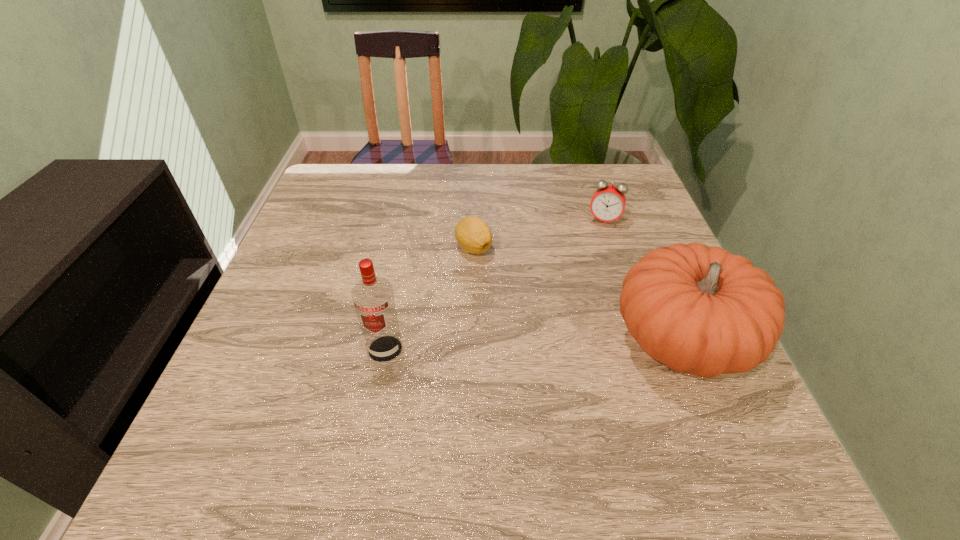
Identify the location of free point located 0.250m at the stem end of the third object from right to left. (497, 348).

You are a GUI agent. You are given a task and a screenshot of the screen. Output one action in this format:
    pyautogui.click(x=<x>, y=<y>)
    Task: Click on the vacant space located 0.140m at the stem end of the third object from right to left
    The height and width of the screenshot is (540, 960).
    Given the screenshot: What is the action you would take?
    (488, 307)

Find the location of `vacant region located 0.110m on the front-facing side of the alarm clock`. vacant region located 0.110m on the front-facing side of the alarm clock is located at coordinates (594, 255).

Where is `vacant region located 0.060m on the front-facing side of the alarm clock`? The height and width of the screenshot is (540, 960). vacant region located 0.060m on the front-facing side of the alarm clock is located at coordinates (597, 243).

At what (x,y) coordinates should I click in order to perform the action: click on vacant region located 0.270m on the front-facing side of the alarm clock. Please return your answer as a coordinate pair (x, y). The image size is (960, 540). Looking at the image, I should click on (583, 302).

Find the location of a particular element. The height and width of the screenshot is (540, 960). object located in the near edge section of the desktop is located at coordinates click(x=699, y=310).

The image size is (960, 540). I want to click on pumpkin situated at the right edge, so click(699, 310).

Identify the location of alarm clock that is positioned at the right edge. (608, 202).

The image size is (960, 540). What are the coordinates of `object that is at the near right corner` in the screenshot? It's located at (699, 310).

At what (x,y) coordinates should I click in order to perform the action: click on vacant space at the far edge of the desktop. Please return your answer as a coordinate pair (x, y). This screenshot has width=960, height=540. Looking at the image, I should click on (401, 180).